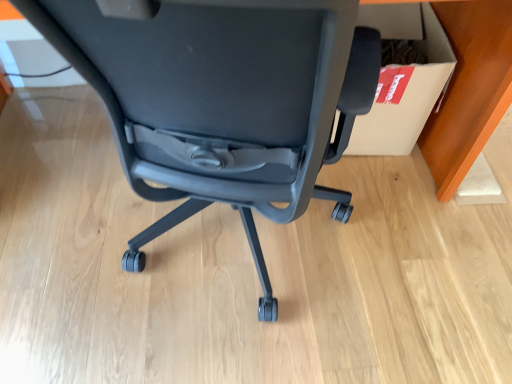
Question: Based on their positions, is white cardboard box at right located to the left or right of matte black chair at center?

Choices:
 (A) left
 (B) right

Answer: (B)

Question: In terms of height, does white cardboard box at right look taller or shorter compared to matte black chair at center?

Choices:
 (A) tall
 (B) short

Answer: (B)

Question: In terms of width, does white cardboard box at right look wider or thinner when compared to matte black chair at center?

Choices:
 (A) thin
 (B) wide

Answer: (A)

Question: Considering the positions of matte black chair at center and white cardboard box at right in the image, is matte black chair at center bigger or smaller than white cardboard box at right?

Choices:
 (A) small
 (B) big

Answer: (B)

Question: Is point (98, 51) closer or farther from the camera than point (389, 13)?

Choices:
 (A) closer
 (B) farther

Answer: (A)

Question: Would you say matte black chair at center is to the left or to the right of white cardboard box at right in the picture?

Choices:
 (A) left
 (B) right

Answer: (A)

Question: Is matte black chair at center in front of or behind white cardboard box at right in the image?

Choices:
 (A) behind
 (B) front

Answer: (B)